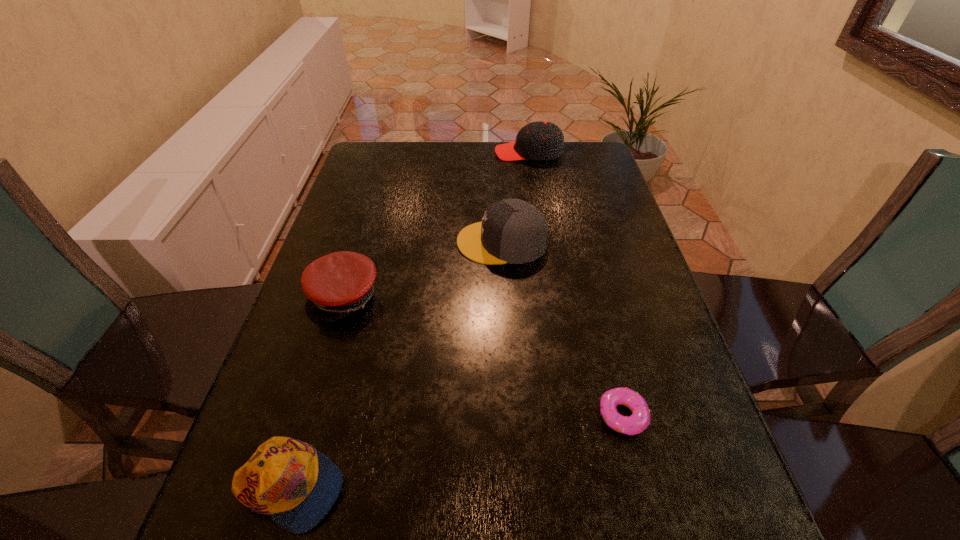
Image resolution: width=960 pixels, height=540 pixels. Identify the location of free spot located 0.290m on the front-facing side of the second farthest cap. (348, 242).

Where is `vacant position located on the front-facing side of the second farthest cap`? This screenshot has height=540, width=960. vacant position located on the front-facing side of the second farthest cap is located at coordinates (416, 242).

I want to click on vacant area located 0.390m at the front of the second nearest cap where the visor is located, so click(x=278, y=515).

At what (x,y) coordinates should I click in order to perform the action: click on vacant space located 0.180m on the bill of the nearest object. Please return your answer as a coordinate pair (x, y). Image resolution: width=960 pixels, height=540 pixels. Looking at the image, I should click on (454, 488).

Locate an element on the screen. The image size is (960, 540). free space located 0.400m on the back of the doughnut is located at coordinates (583, 256).

At what (x,y) coordinates should I click in order to perform the action: click on object at the far edge. Please return your answer as a coordinate pair (x, y). This screenshot has height=540, width=960. Looking at the image, I should click on (539, 140).

This screenshot has width=960, height=540. In order to click on cap present at the right edge in this screenshot , I will do `click(539, 140)`.

Image resolution: width=960 pixels, height=540 pixels. In order to click on doughnut positioned at the right edge in this screenshot , I will do `click(640, 419)`.

Where is `object present at the far right corner`? This screenshot has height=540, width=960. object present at the far right corner is located at coordinates (539, 140).

I want to click on free space at the left edge, so click(x=277, y=387).